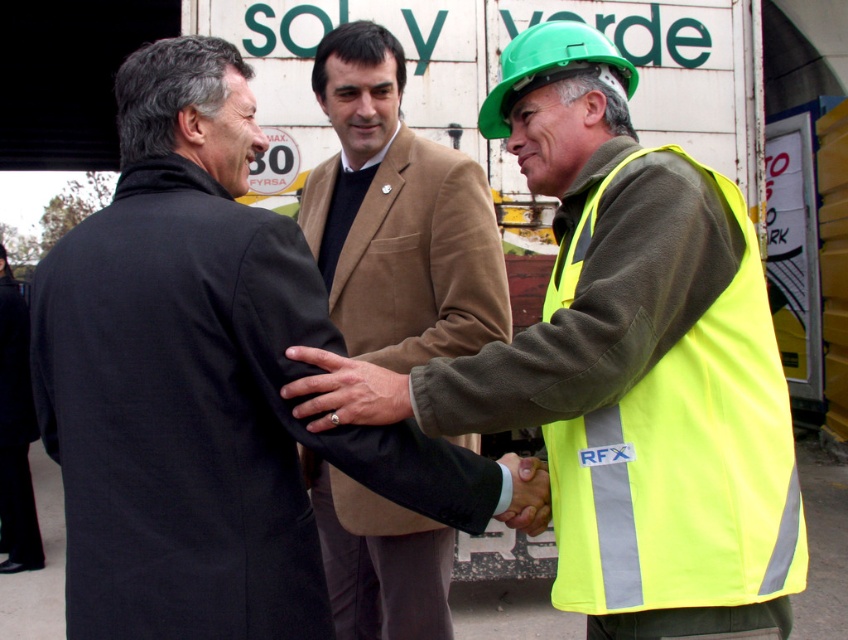
This screenshot has width=848, height=640. Describe the element at coordinates (202, 381) in the screenshot. I see `matte black coat at center` at that location.

Is matte black coat at center smaller than neon yellow safety vest at center?

Indeed, matte black coat at center has a smaller size compared to neon yellow safety vest at center.

What are the coordinates of `matte black coat at center` in the screenshot? It's located at (202, 381).

Is neon yellow safety vest at center thinner than matte black hand at center?

Incorrect, neon yellow safety vest at center's width is not less than matte black hand at center's.

Is neon yellow safety vest at center taller than matte black hand at center?

Correct, neon yellow safety vest at center is much taller as matte black hand at center.

Who is more distant from viewer, (667, 179) or (539, 508)?

The point (539, 508) is more distant.

Find the location of `neon yellow safety vest at center`. neon yellow safety vest at center is located at coordinates (633, 356).

In the scene shown: Is matte black coat at center thinner than matte black hand at center?

Incorrect, matte black coat at center's width is not less than matte black hand at center's.

Does matte black coat at center have a greater width compared to matte black hand at center?

Yes.

Identify the location of matte black coat at center. (202, 381).

Find the location of a particular element. The image size is (848, 640). matte black coat at center is located at coordinates (202, 381).